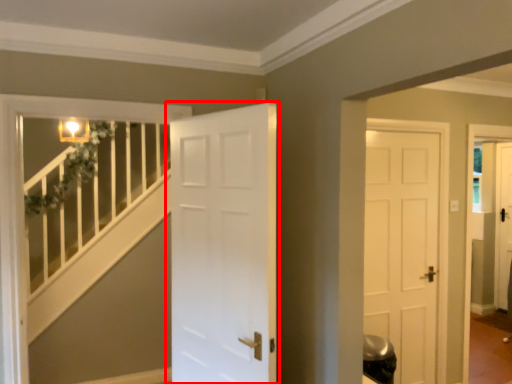
Question: In this image, where is door (annotated by the red box) located relative to balustrade?

Choices:
 (A) right
 (B) left

Answer: (A)